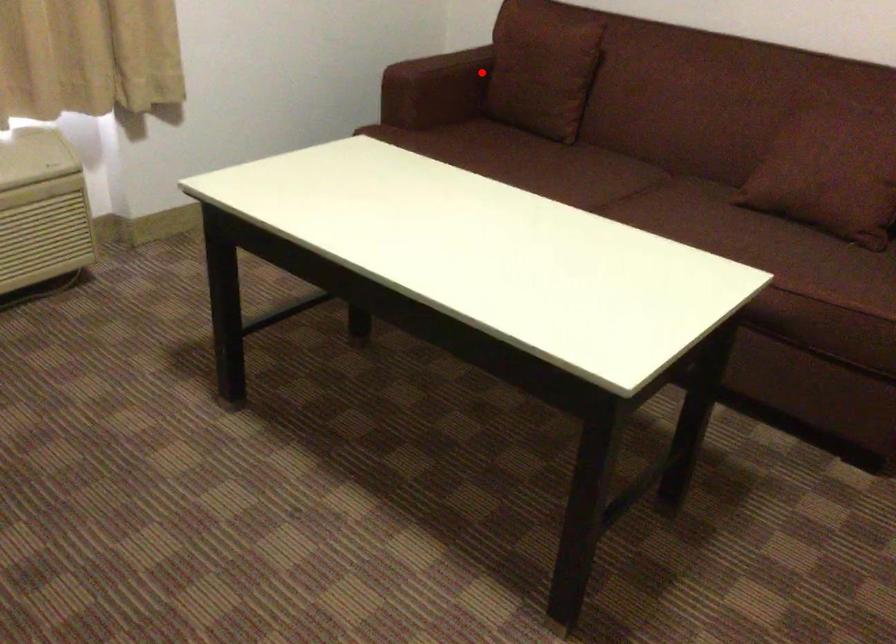
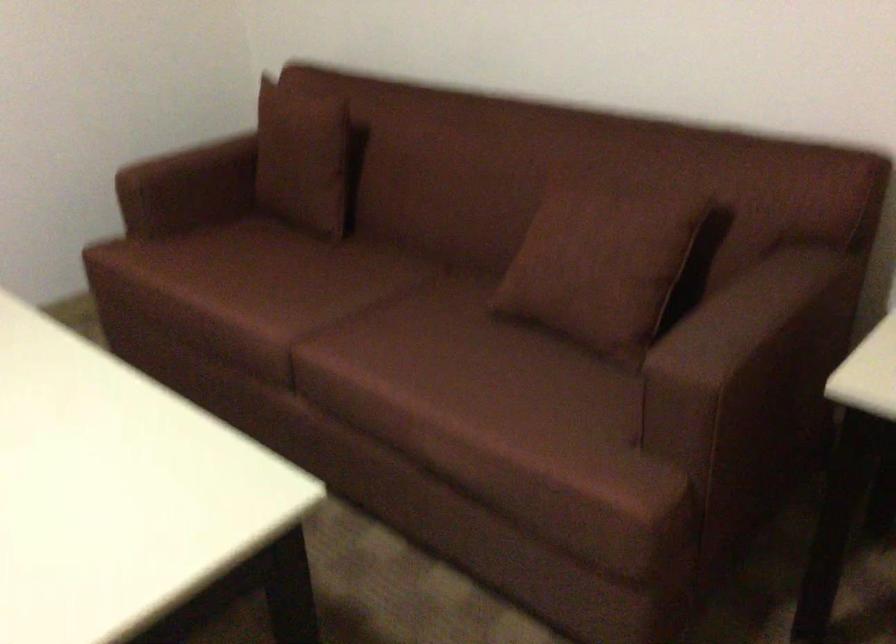
The point at the highlighted location is marked in the first image. Where is the corresponding point in the second image?

(246, 165)